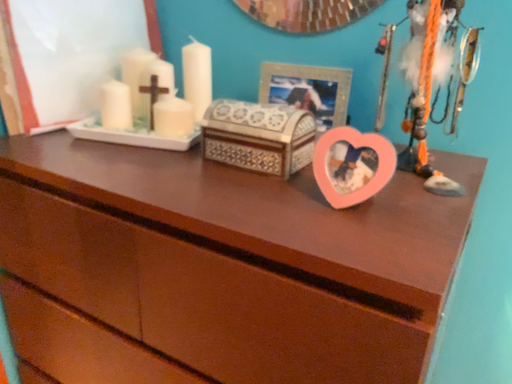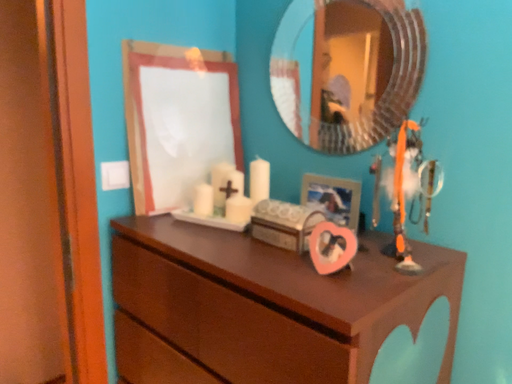
Question: How did the camera likely rotate when shooting the video?

Choices:
 (A) rotated left
 (B) rotated right

Answer: (A)